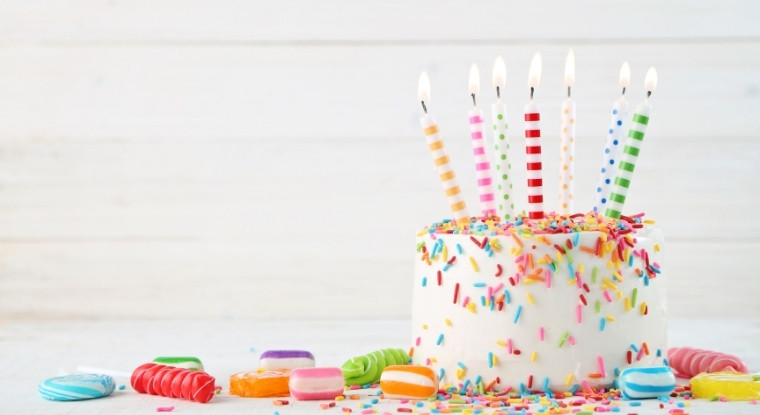
At what (x,y) coordinates should I click in order to perform the action: click on candle flames. Please return your answer as a coordinate pair (x, y). This screenshot has height=415, width=760. Looking at the image, I should click on (425, 86), (475, 84), (498, 79), (534, 77), (567, 73), (644, 85), (631, 85).